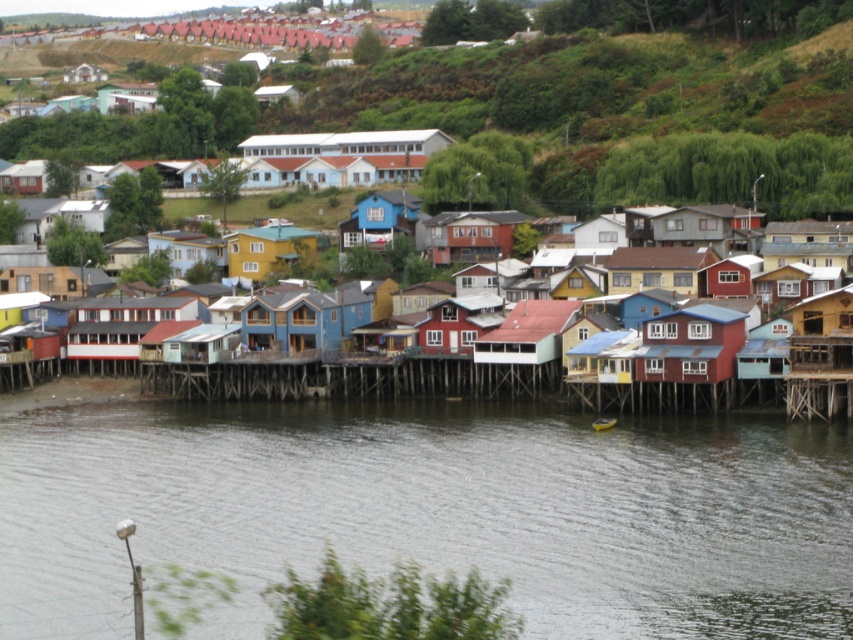
You are standing at the edge of the coastal settlement and want to take a photo of the gray water at lower center. If your camera has a maximum zoom range of 50 meters, will you need to move closer to capture the water clearly?

The gray water at lower center is 72.45 meters away from the camera. Since the camera can only zoom up to 50 meters, you will need to move closer to capture the water clearly.

Based on the photo, you are a tourist standing at the edge of the coastal settlement. You notice the gray water at lower center and the yellow matte house at center. Which one appears wider from your viewpoint?

The gray water at lower center appears wider than the yellow matte house at center because its width surpasses that of the yellow matte house at center.